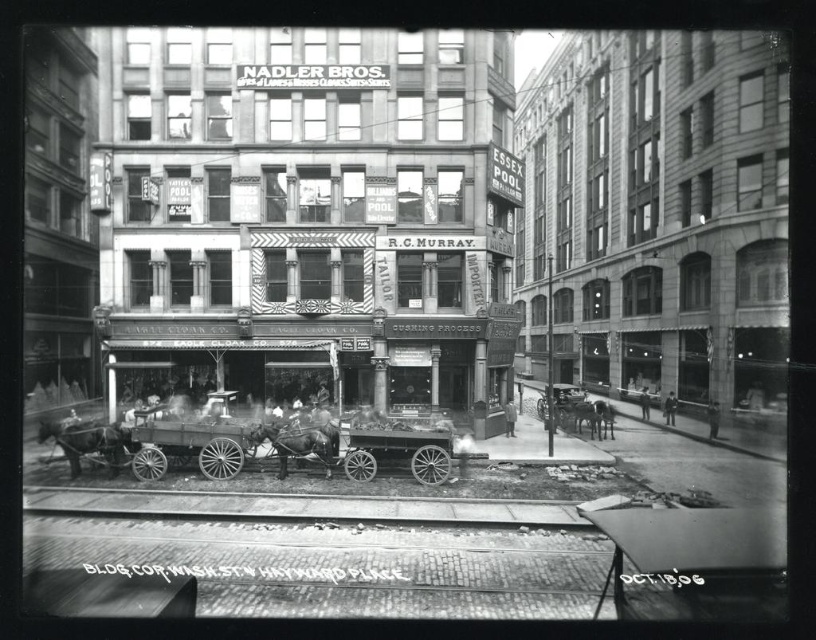
Is brown leather horse at center to the right of gray matte horse at center from the viewer's perspective?

Incorrect, brown leather horse at center is not on the right side of gray matte horse at center.

Is brown leather horse at center shorter than gray matte horse at center?

No.

Identify the location of brown leather horse at center. This screenshot has height=640, width=816. (296, 444).

Is point (82, 454) positioned before point (254, 440)?

Yes, point (82, 454) is closer to viewer.

Who is positioned more to the right, brown glossy horse at lower left or brown leather horse at center?

Positioned to the right is brown leather horse at center.

Does point (109, 444) come in front of point (267, 436)?

Yes, it is.

At what (x,y) coordinates should I click in order to perform the action: click on brown glossy horse at lower left. Please return your answer as a coordinate pair (x, y). The height and width of the screenshot is (640, 816). Looking at the image, I should click on (85, 442).

Is brown glossy horse at lower left positioned before gray matte horse at center?

Yes, it is.

Does brown glossy horse at lower left appear over gray matte horse at center?

Yes, brown glossy horse at lower left is above gray matte horse at center.

Is point (58, 422) more distant than point (595, 406)?

No, it is not.

Find the location of a particular element. brown glossy horse at lower left is located at coordinates (85, 442).